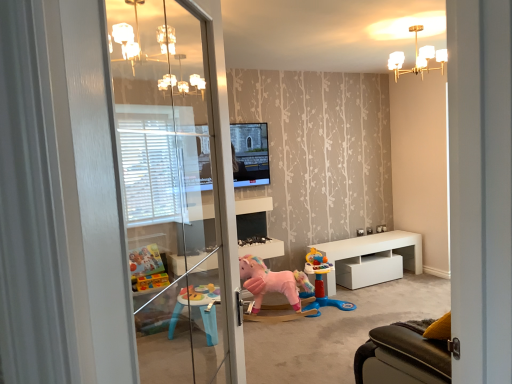
Question: Is the depth of matte black television at center greater than that of white glossy table at lower right?

Choices:
 (A) yes
 (B) no

Answer: (B)

Question: Could white glossy table at lower right be considered to be inside matte black television at center?

Choices:
 (A) yes
 (B) no

Answer: (B)

Question: Is matte black television at center taller than white glossy table at lower right?

Choices:
 (A) yes
 (B) no

Answer: (A)

Question: Considering the relative sizes of matte black television at center and white glossy table at lower right in the image provided, is matte black television at center bigger than white glossy table at lower right?

Choices:
 (A) no
 (B) yes

Answer: (A)

Question: Is matte black television at center oriented away from white glossy table at lower right?

Choices:
 (A) no
 (B) yes

Answer: (A)

Question: From a real-world perspective, relative to transparent glass screen door at left, is pink plush rocking horse at center, arranged as the 1th toy when viewed from the left, vertically above or below?

Choices:
 (A) below
 (B) above

Answer: (A)

Question: From the image's perspective, is pink plush rocking horse at center, positioned as the second toy in right-to-left order, located above or below transparent glass screen door at left?

Choices:
 (A) above
 (B) below

Answer: (B)

Question: Is point (291, 289) positioned closer to the camera than point (81, 269)?

Choices:
 (A) closer
 (B) farther

Answer: (B)

Question: Considering the positions of pink plush rocking horse at center, positioned as the second toy in right-to-left order, and transparent glass screen door at left in the image, is pink plush rocking horse at center, positioned as the second toy in right-to-left order, taller or shorter than transparent glass screen door at left?

Choices:
 (A) short
 (B) tall

Answer: (A)

Question: Considering the positions of transparent glass screen door at left and matte black television at center in the image, is transparent glass screen door at left taller or shorter than matte black television at center?

Choices:
 (A) short
 (B) tall

Answer: (B)

Question: From the image's perspective, is transparent glass screen door at left above or below matte black television at center?

Choices:
 (A) below
 (B) above

Answer: (A)

Question: In terms of size, does transparent glass screen door at left appear bigger or smaller than matte black television at center?

Choices:
 (A) big
 (B) small

Answer: (A)

Question: Is transparent glass screen door at left wider or thinner than matte black television at center?

Choices:
 (A) wide
 (B) thin

Answer: (A)

Question: From the image's perspective, is transparent glass screen door at left located above or below white glossy table at lower right?

Choices:
 (A) above
 (B) below

Answer: (A)

Question: From their relative heights in the image, would you say transparent glass screen door at left is taller or shorter than white glossy table at lower right?

Choices:
 (A) short
 (B) tall

Answer: (B)